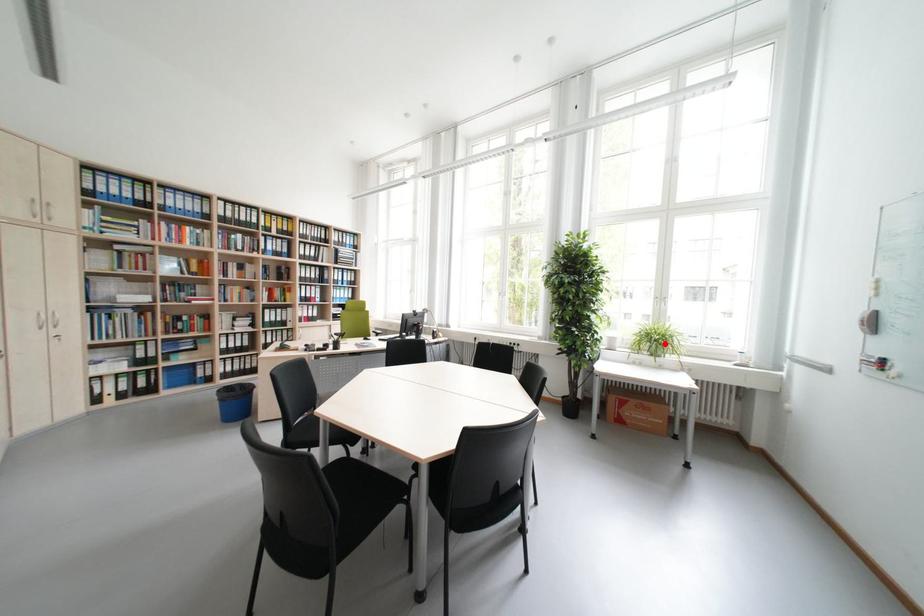
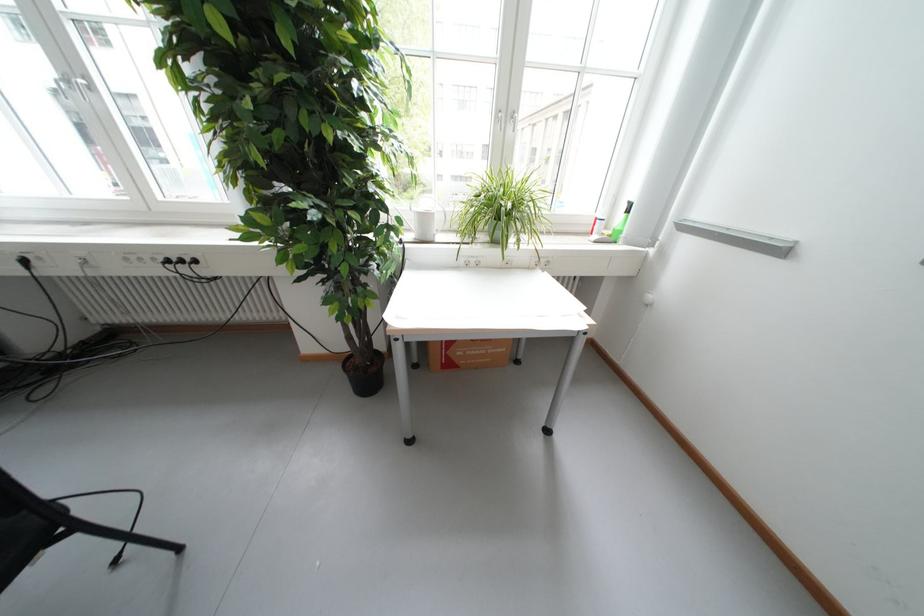
The point at the highlighted location is marked in the first image. Where is the corresponding point in the second image?

(508, 217)